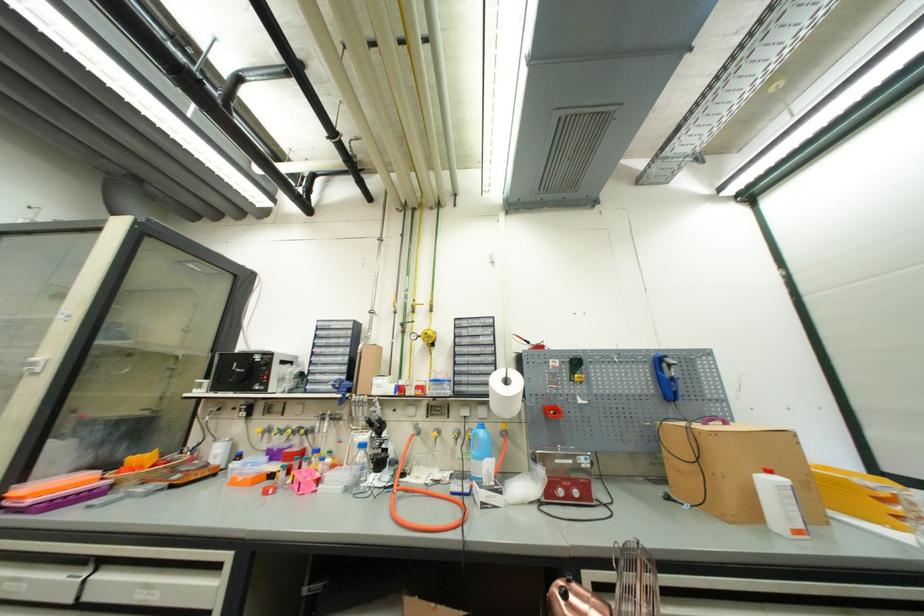
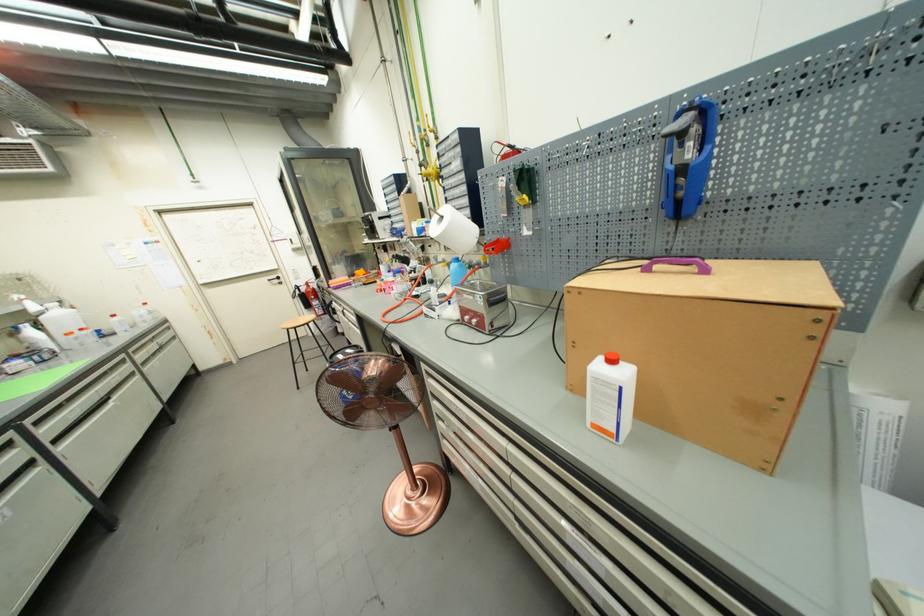
Locate, in the second image, the point that corresponds to point 482,430 in the first image.

(458, 264)